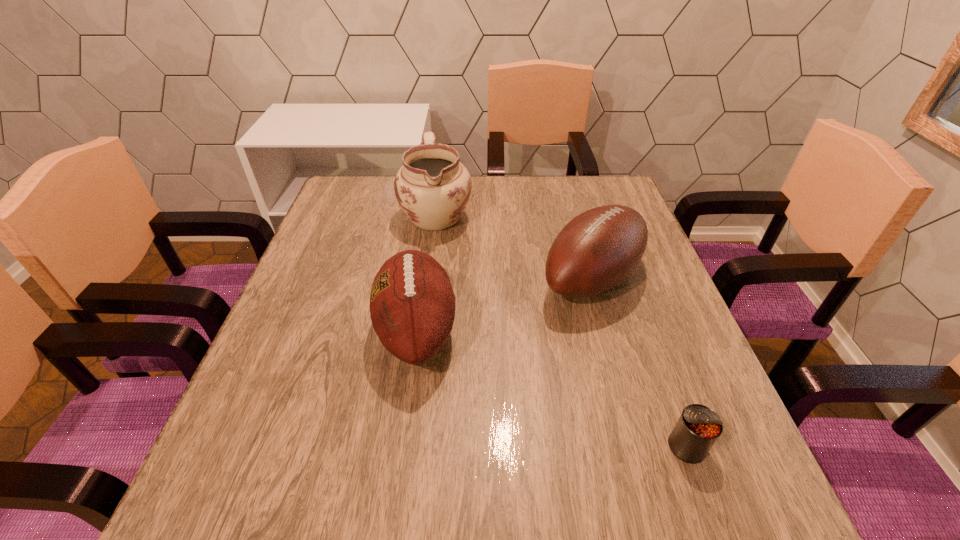
You are a GUI agent. You are given a task and a screenshot of the screen. Output one action in this format:
    pyautogui.click(x=<x>, y=<y>)
    Task: Click on the football (American) at the right edge
    
    Given the screenshot: What is the action you would take?
    pyautogui.click(x=597, y=250)

Locate an element on the screen. This screenshot has height=540, width=960. can situated at the right edge is located at coordinates (697, 429).

I want to click on vacant space at the far edge of the desktop, so click(x=521, y=181).

In the image, there is a desktop. Identify the location of vacant space at the near edge. Image resolution: width=960 pixels, height=540 pixels. (580, 512).

Image resolution: width=960 pixels, height=540 pixels. I want to click on vacant region at the left edge of the desktop, so click(x=344, y=259).

In order to click on vacant space at the right edge of the desktop in this screenshot , I will do (634, 280).

Locate an element on the screen. This screenshot has width=960, height=540. vacant space at the far left corner of the desktop is located at coordinates (348, 187).

The image size is (960, 540). In order to click on vacant region at the far right corner of the desktop in this screenshot , I will do `click(608, 189)`.

Identify the location of free space between the left football (American) and the shortest object. The width and height of the screenshot is (960, 540). (552, 389).

Where is `free space between the farthest object and the right football (American)`? Image resolution: width=960 pixels, height=540 pixels. free space between the farthest object and the right football (American) is located at coordinates tap(514, 247).